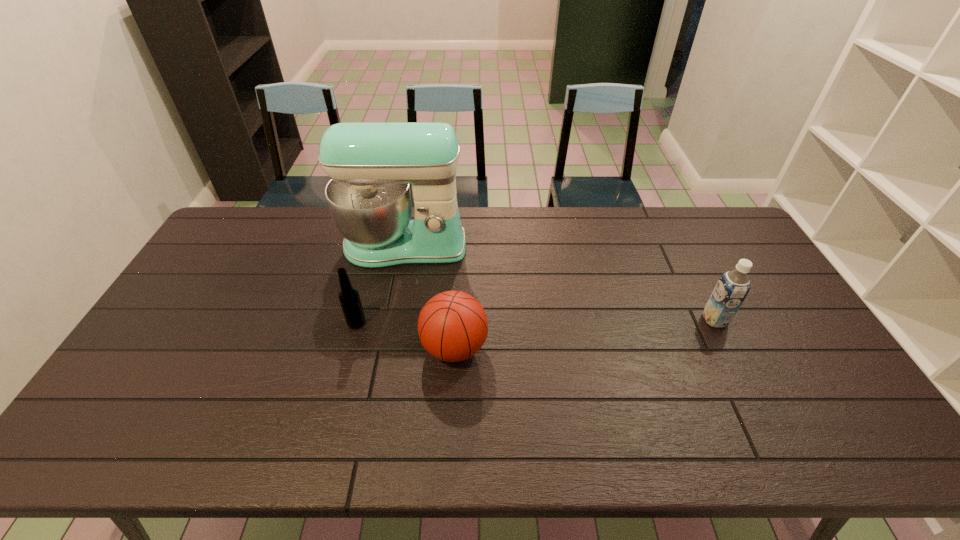
The height and width of the screenshot is (540, 960). Identify the location of blank area in the image that satisfies the following two spatial constraints: 1. at the base of the basketball; 2. on the left side of the farthest object. (385, 348).

Image resolution: width=960 pixels, height=540 pixels. What are the coordinates of `vacant point that satisfies the following two spatial constraints: 1. at the base of the farthest object; 2. on the right side of the basketball` in the screenshot? It's located at (385, 348).

Find the location of a particular element. This screenshot has height=540, width=960. vacant space that satisfies the following two spatial constraints: 1. on the front side of the basketball; 2. on the left side of the beer bottle is located at coordinates (349, 348).